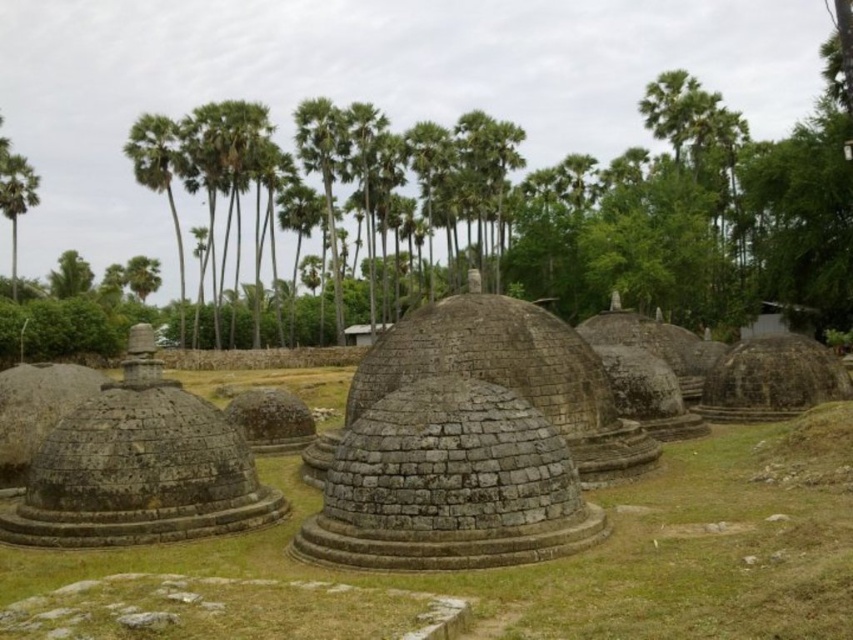
You are standing in the outdoor scene and want to place a small garden ornament on the ground. You have two options for placement near the green grass at center and the smooth gray stone hut at center. Which location would be closer to you?

The green grass at center is closer to the viewer than the smooth gray stone hut at center, so placing the ornament near the green grass at center would be closer to you.

You are standing in the middle of the ancient stone structures and want to walk towards the palm trees in the background. Which point, point (190, 467) or point (331, 232), is closer to your current position?

Point (190, 467) is closer to the viewer than point (331, 232), so it is closer to your current position.

You are a gardener who needs to mow the green grass at center. To reach the grass, you must pass through the gray stone dome at center. Is this possible?

The green grass at center is located below the gray stone dome at center, so you cannot pass through the dome to reach the grass. You need to find another path around the structure.